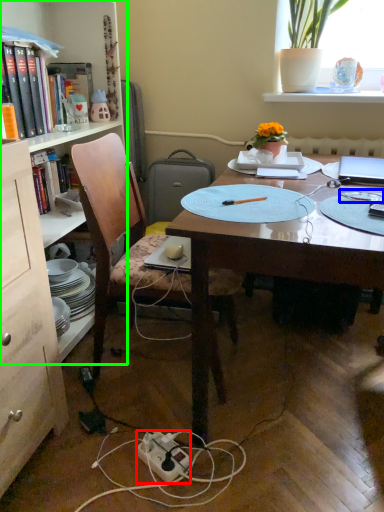
Question: Based on their relative distances, which object is farther from power outlet (highlighted by a red box)? Choose from tableware (highlighted by a blue box) and bookcase (highlighted by a green box).

Choices:
 (A) tableware
 (B) bookcase

Answer: (B)